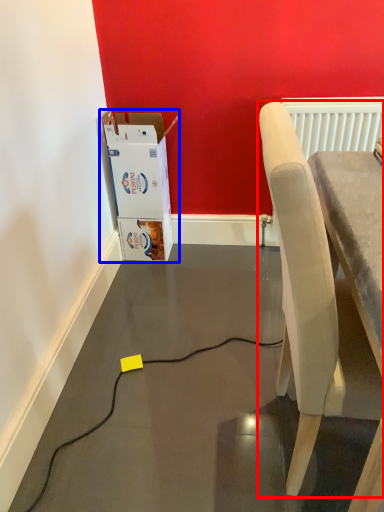
Question: Which point is further to the camera, chair (highlighted by a red box) or cardboard box (highlighted by a blue box)?

Choices:
 (A) chair
 (B) cardboard box

Answer: (B)